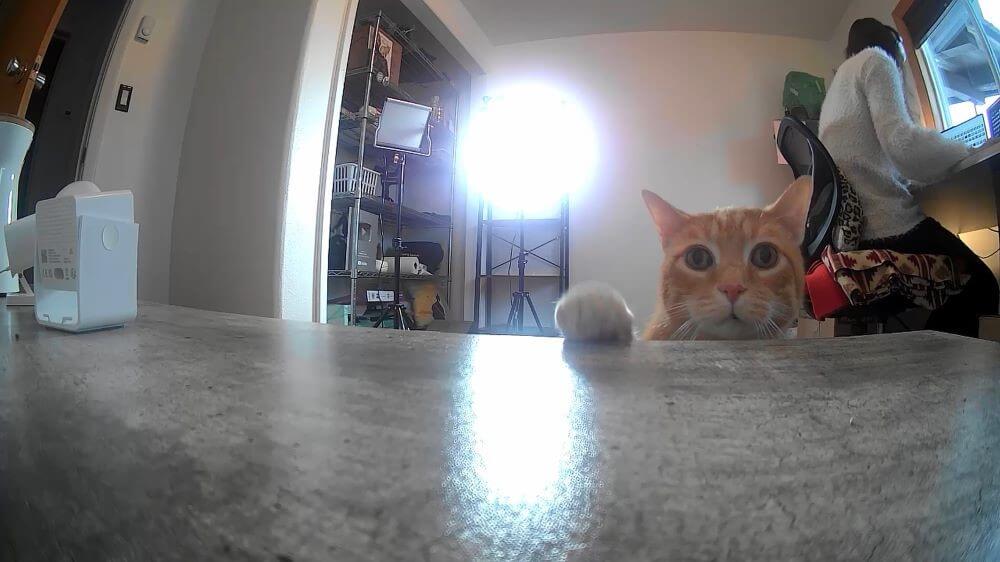
You are a GUI agent. You are given a task and a screenshot of the screen. Output one action in this format:
    pyautogui.click(x=<x>, y=<y>)
    Task: Click on the desk fan
    The height and width of the screenshot is (562, 1000).
    Given the screenshot: What is the action you would take?
    [82, 246]